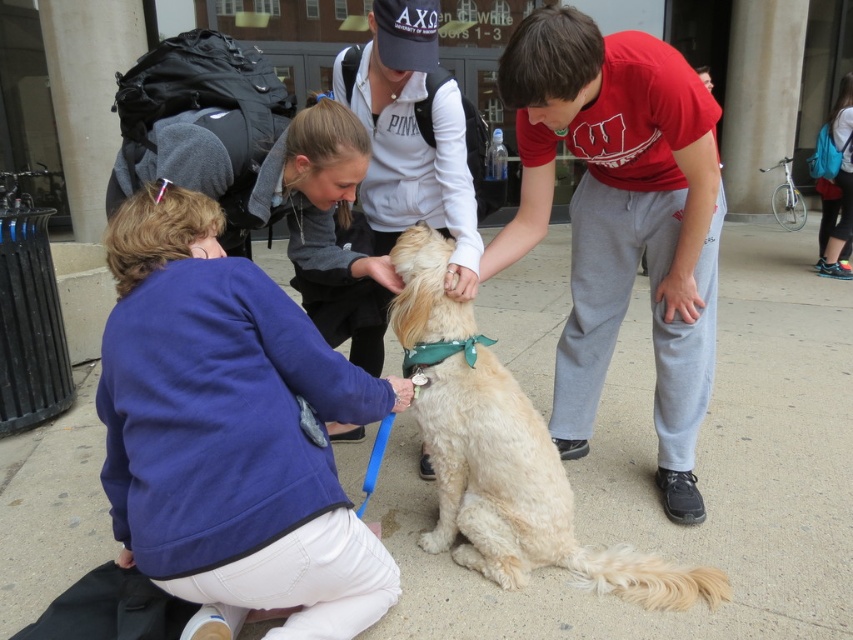
Can you confirm if smooth concrete pavement at center is bigger than golden fur dog at center?

Actually, smooth concrete pavement at center might be smaller than golden fur dog at center.

Does smooth concrete pavement at center have a lesser height compared to golden fur dog at center?

Answer: Correct, smooth concrete pavement at center is not as tall as golden fur dog at center.

The width and height of the screenshot is (853, 640). I want to click on smooth concrete pavement at center, so click(x=695, y=470).

At what (x,y) coordinates should I click in order to perform the action: click on smooth concrete pavement at center. Please return your answer as a coordinate pair (x, y). The width and height of the screenshot is (853, 640). Looking at the image, I should click on (695, 470).